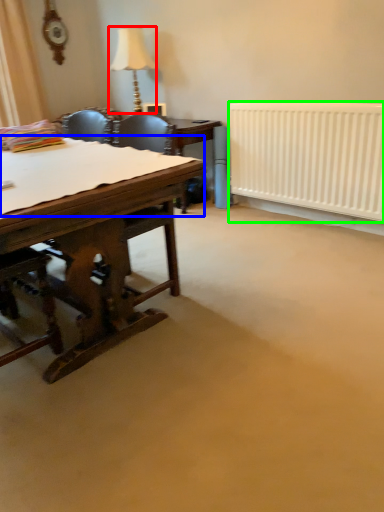
Question: Considering the real-world distances, which object is closest to lamp (highlighted by a red box)? sheet (highlighted by a blue box) or radiator (highlighted by a green box).

Choices:
 (A) sheet
 (B) radiator

Answer: (B)